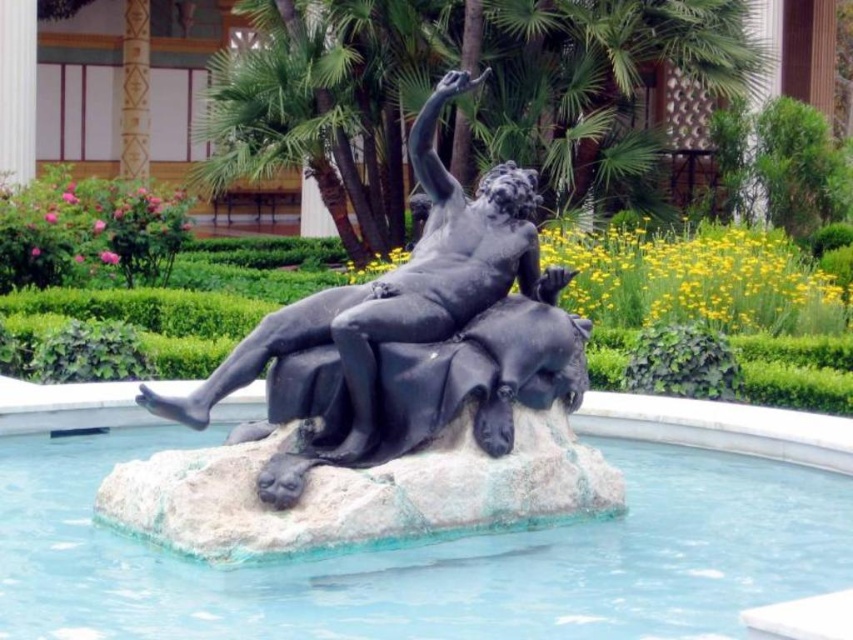
You are standing in front of the classical bronze sculpture in the garden. You notice two points marked on the sculpture. The first point is at coordinate point (339, 605) and the second point is at coordinate point (173, 410). Which of these two points appears closer to you when observing the sculpture?

Point (339, 605) is closer to the camera than point (173, 410), so the first point appears closer to you.

You are standing at point A with coordinates point A at (741,518). You want to walk to point B, which is 27.94 meters away from you. Can you estimate how far you need to walk to reach point B?

You need to walk 27.94 meters to reach point B.

You are standing in the garden and want to place a small decorative statue exactly at the center of the smooth stone pool at center. According to the coordinates provided, where should you place the statue?

The smooth stone pool at center is located at coordinates point [445,541], so you should place the statue exactly at that point to center it.